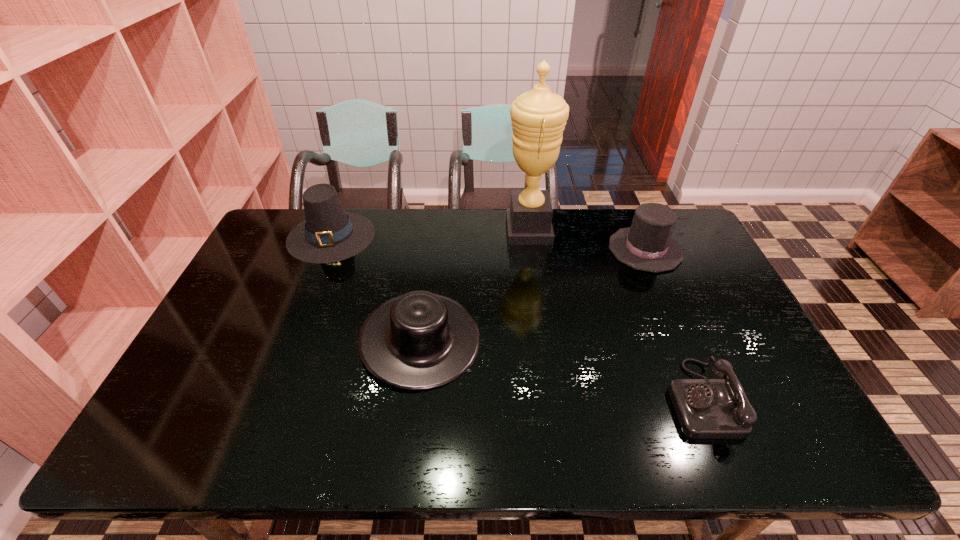
Identify which object is located as the nearest to the leftmost object. Please provide its 2D coordinates. Your answer should be formatted as a tuple, i.e. [(x, y)], where the tuple contains the x and y coordinates of a point satisfying the conditions above.

[(420, 340)]

Locate which object ranks fourth in proximity to the trophy cup. Please provide its 2D coordinates. Your answer should be formatted as a tuple, i.e. [(x, y)], where the tuple contains the x and y coordinates of a point satisfying the conditions above.

[(706, 408)]

You are a GUI agent. You are given a task and a screenshot of the screen. Output one action in this format:
    pyautogui.click(x=<x>, y=<y>)
    Task: Click on the second closest dress hat relative to the telephone
    
    Given the screenshot: What is the action you would take?
    pyautogui.click(x=420, y=340)

Where is `dress hat that stands as the closest to the trophy cup`? Image resolution: width=960 pixels, height=540 pixels. dress hat that stands as the closest to the trophy cup is located at coordinates (647, 245).

Where is `vacant position in the image that satisfies the following two spatial constraints: 1. at the front of the trophy cup with handles; 2. on the front-facing side of the fourth shortest object`? This screenshot has height=540, width=960. vacant position in the image that satisfies the following two spatial constraints: 1. at the front of the trophy cup with handles; 2. on the front-facing side of the fourth shortest object is located at coordinates click(x=530, y=235).

Locate an element on the screen. This screenshot has height=540, width=960. free space that satisfies the following two spatial constraints: 1. at the front of the trophy cup with handles; 2. on the front-facing side of the tallest dress hat is located at coordinates (530, 235).

The width and height of the screenshot is (960, 540). I want to click on vacant area that satisfies the following two spatial constraints: 1. on the front-facing side of the fourth object from right to left; 2. on the left side of the tallest dress hat, so click(x=289, y=340).

This screenshot has width=960, height=540. Identify the location of free space in the image that satisfies the following two spatial constraints: 1. at the front of the third object from right to left with handles; 2. on the front side of the fourth object from right to left. (543, 340).

The image size is (960, 540). I want to click on vacant region that satisfies the following two spatial constraints: 1. on the front of the rightmost dress hat with the decoration; 2. on the dial of the telephone, so click(709, 399).